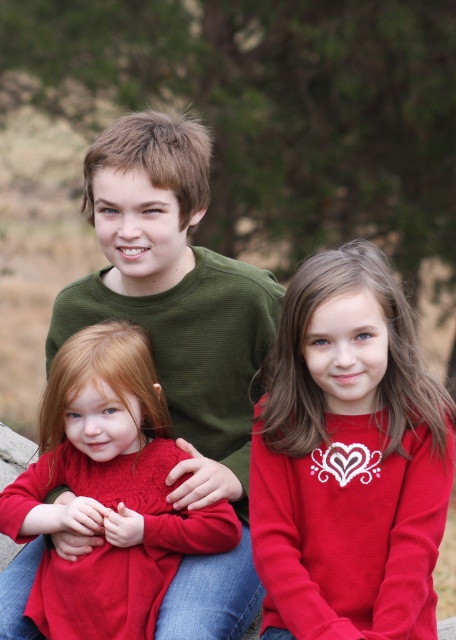
You are a fashion designer observing the image of three children in a park. You notice two matte red sweater at center and matte red sweater at left. Which one has a wider width?

The matte red sweater at left has a wider width than the matte red sweater at center.

You are a photographer trying to capture a candid shot of the two children in the image. The camera you are using has a depth of field that can focus on objects within a 10 inch range. If you focus on the green textured sweater at center, will the matte red sweater at left also be in focus?

The distance between the green textured sweater at center and the matte red sweater at left is 10.38 inches. Since the camera can only focus within a 10 inch range, the matte red sweater at left will be slightly out of focus.

You are a photographer setting up for a family photo. You see the matte red sweater at center and the green textured sweater at center. Which sweater should you adjust to ensure the red sweater is on the left side of the green sweater?

The matte red sweater at center is currently to the right of the green textured sweater at center. To have the red sweater on the left side of the green sweater, you need to swap their positions so that the matte red sweater at center moves to the left of the green textured sweater at center.